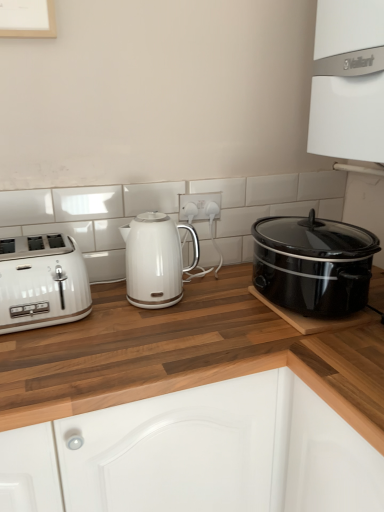
Find the location of a particular element. vacant space situated above wooden at left (from a real-world perspective) is located at coordinates (112, 334).